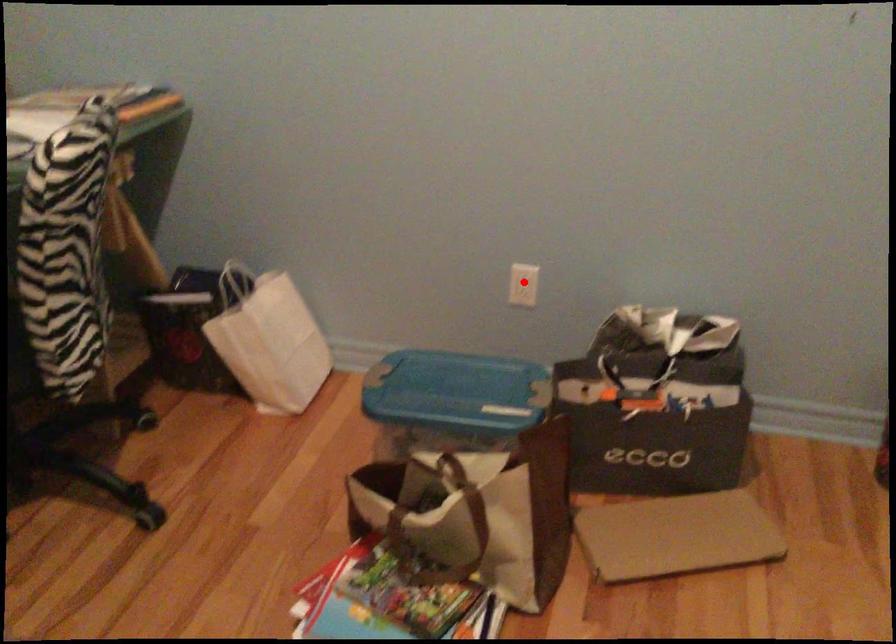
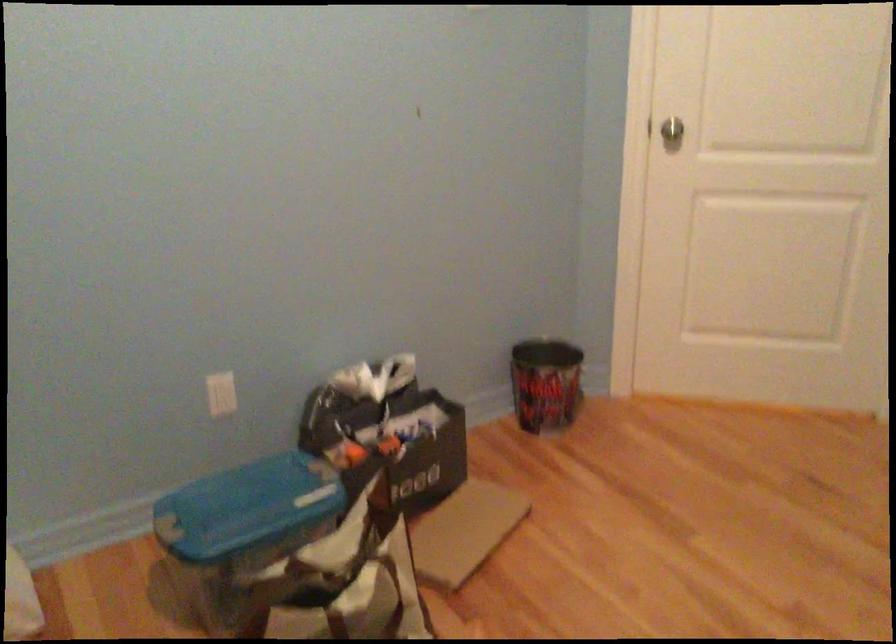
Find the pixel in the second image that matches the highlighted location in the first image.

(220, 393)